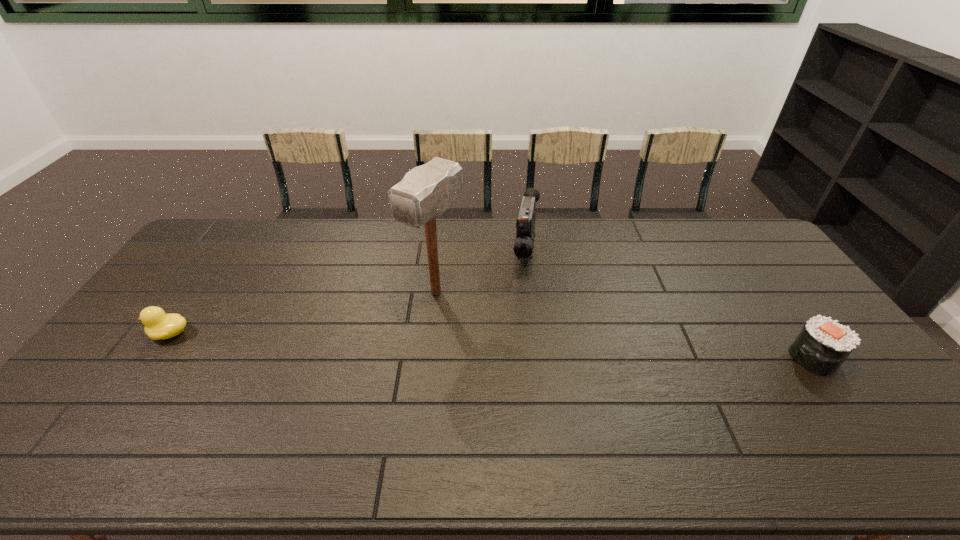
In the image, there is a desktop. Where is `vacant region at the right edge`? The width and height of the screenshot is (960, 540). vacant region at the right edge is located at coordinates (782, 266).

Where is `free space between the leftmost object and the camcorder`? free space between the leftmost object and the camcorder is located at coordinates (348, 293).

Locate an element on the screen. The height and width of the screenshot is (540, 960). free space between the rightmost object and the leftmost object is located at coordinates (492, 346).

Where is `free spot between the second object from right to left and the mallet`? This screenshot has width=960, height=540. free spot between the second object from right to left and the mallet is located at coordinates (481, 273).

Identify the location of free spot between the rightmost object and the second object from left to right. (625, 325).

Identify the location of free space between the sushi and the third shortest object. This screenshot has width=960, height=540. (669, 305).

Identify the location of free space between the duckling and the tallest object. The width and height of the screenshot is (960, 540). (303, 313).

Locate an element on the screen. free spot between the sushi and the third object from right to left is located at coordinates (625, 325).

I want to click on empty location between the third shortest object and the sushi, so click(x=669, y=305).

In order to click on free area in between the third shortest object and the second object from left to right in this screenshot , I will do 481,273.